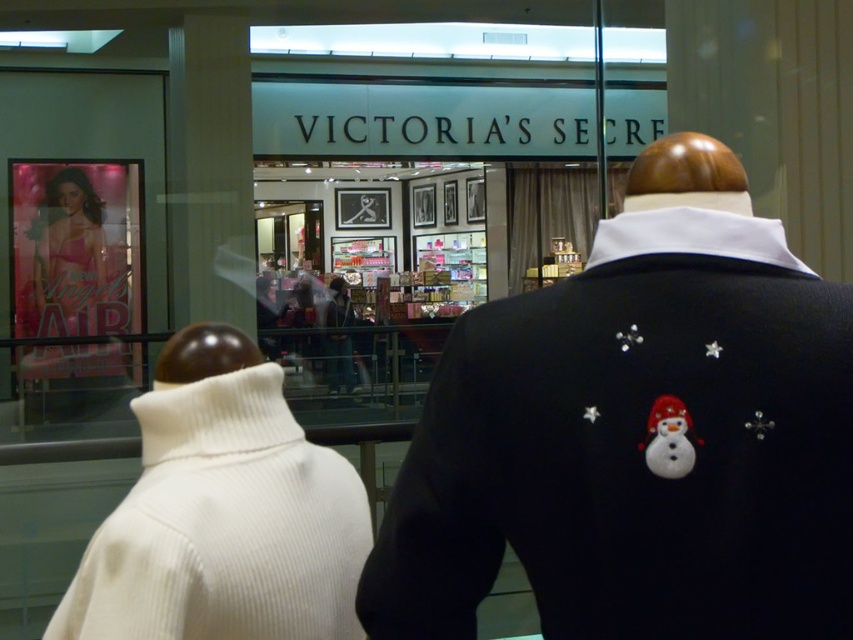
Question: Which object is farther from the camera taking this photo?

Choices:
 (A) matte pink lingerie at left
 (B) white ribbed sweater at left
 (C) white glossy snowman at center

Answer: (A)

Question: Is black wool sweater at right further to camera compared to white ribbed sweater at left?

Choices:
 (A) yes
 (B) no

Answer: (B)

Question: Which point is farther to the camera?

Choices:
 (A) white glossy snowman at center
 (B) matte pink lingerie at left
 (C) white ribbed sweater at left

Answer: (B)

Question: Considering the relative positions of black wool sweater at right and white ribbed sweater at left in the image provided, where is black wool sweater at right located with respect to white ribbed sweater at left?

Choices:
 (A) left
 (B) right

Answer: (B)

Question: In this image, where is black wool sweater at right located relative to matte pink lingerie at left?

Choices:
 (A) left
 (B) right

Answer: (B)

Question: Which point appears farthest from the camera in this image?

Choices:
 (A) (318, 568)
 (B) (99, 202)
 (C) (654, 436)
 (D) (548, 413)

Answer: (B)